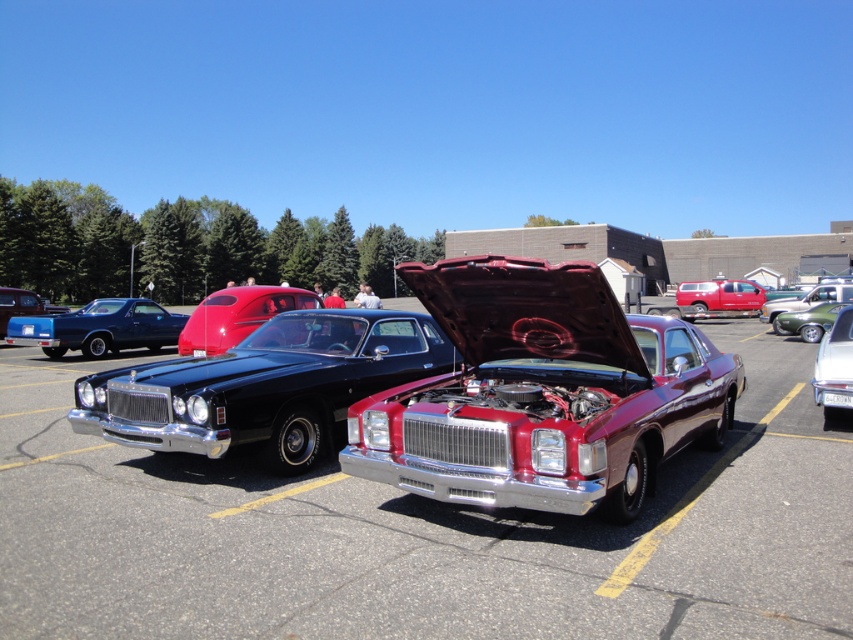
You are at a car show and want to take a photo of both the glossy black car at center and the shiny blue car at left. Since you have a wide angle lens, you need to know which car is smaller to frame them properly. Which car is smaller in size?

The glossy black car at center has a smaller size compared to the shiny blue car at left, so the glossy black car at center is the smaller one.

You are at the car show and want to take a photo of both cars. The first car is at point (x=750, y=321) and the second car is at point (x=811, y=314). Since you want to capture both cars in the same frame, which car should you position closer to the camera to ensure both are visible?

To capture both cars in the same frame, you should position yourself closer to the car at point (x=811, y=314) since it is in front of the other car at point (x=750, y=321). This way, both cars will be visible without one blocking the other.